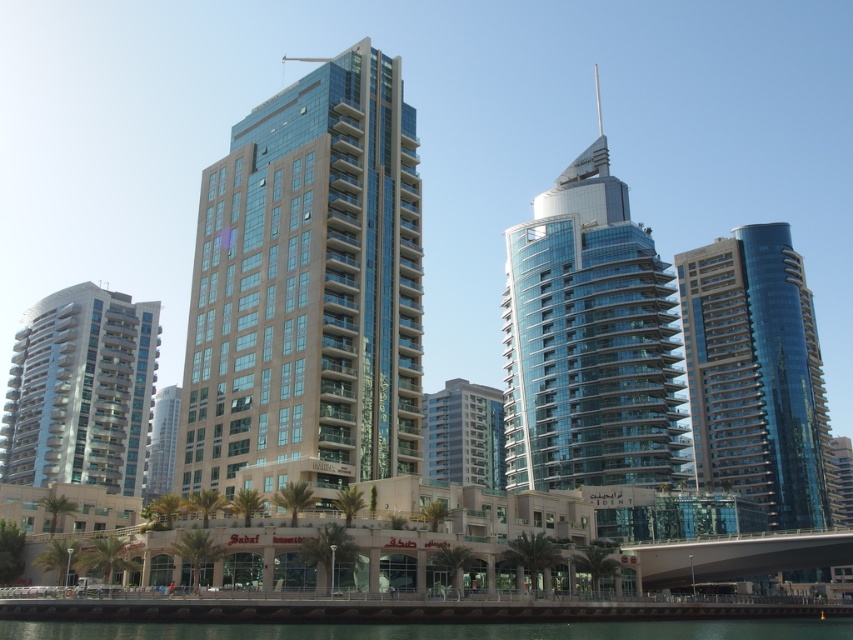
Consider the image. You are standing on the promenade and want to walk to both the point at coordinates (325,163) and the point at coordinates (427,420). Which point will you reach first if you start walking towards them?

You will reach the point at coordinates (325,163) first because it is closer to you than the point at coordinates (427,420).

You are a city planner evaluating the skyline of this urban waterfront. You notice the beige glass building at center and the matte glass tower at center. Which of these two buildings is taller?

The beige glass building at center is taller than the matte glass tower at center.

You are an architect evaluating the urban skyline. You notice the beige glass building at center and the matte glass building at left. Which building is taller based on their positions in the image?

The beige glass building at center is taller than the matte glass building at left according to their positions in the image.